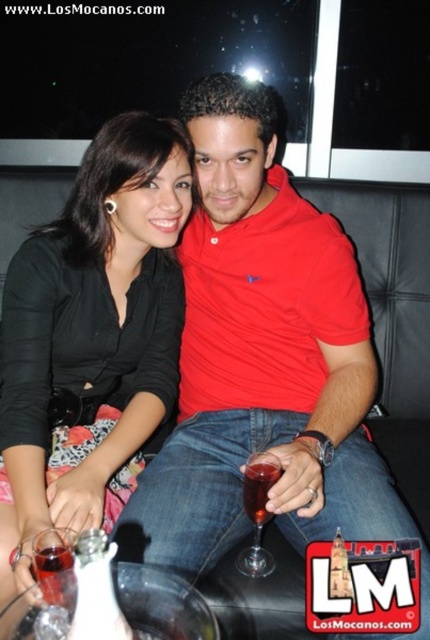
Question: Can you confirm if matte black shirt at center is positioned below translucent glass wine glass at lower left?

Choices:
 (A) no
 (B) yes

Answer: (A)

Question: Does translucent glass wine glass at lower left lie in front of translucent glass wine at center?

Choices:
 (A) no
 (B) yes

Answer: (B)

Question: Is translucent glass wine glass at lower left to the left of translucent glass wine glass at center from the viewer's perspective?

Choices:
 (A) no
 (B) yes

Answer: (B)

Question: Which of the following is the closest to the observer?

Choices:
 (A) red cotton polo shirt at center
 (B) translucent glass wine at center
 (C) matte black shirt at center
 (D) translucent glass wine glass at center

Answer: (A)

Question: Which object appears closest to the camera in this image?

Choices:
 (A) translucent glass wine glass at lower left
 (B) translucent glass wine glass at center

Answer: (A)

Question: Which of these objects is positioned closest to the translucent glass wine at center?

Choices:
 (A) translucent glass wine glass at center
 (B) translucent glass wine glass at lower left
 (C) translucent glass at lower left

Answer: (A)